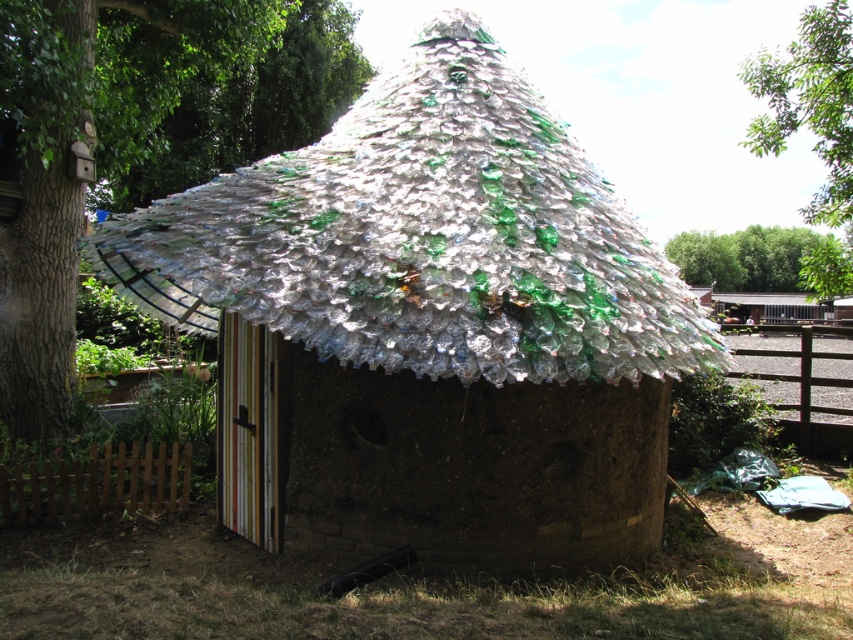
You are standing in front of the hut and notice a translucent plastic umbrella at center and a green leafy tree at upper right. Which object is closer to you?

The translucent plastic umbrella at center is closer to you because it is in front of the green leafy tree at upper right.

You are standing in front of the hut and notice both the translucent plastic umbrella at center and the translucent plastic bottles at center. Which object is closer to you?

The translucent plastic umbrella at center is closer to you because it is in front of the translucent plastic bottles at center.